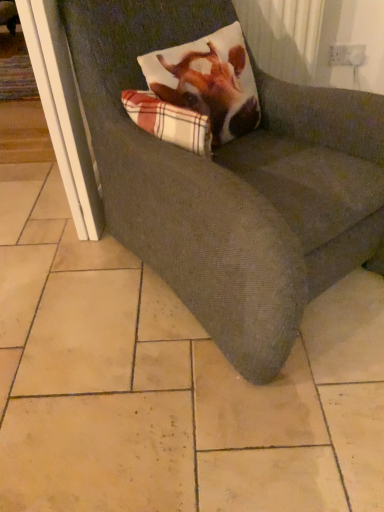
The image size is (384, 512). What are the coordinates of `vacant space situated on the left part of white plastic screen door at left` in the screenshot? It's located at (29, 197).